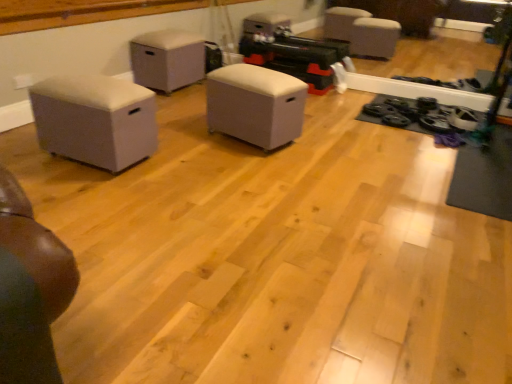
The image size is (512, 384). What do you see at coordinates (255, 105) in the screenshot? I see `white fabric ottoman at center, placed as the 2th furniture when sorted from front to back` at bounding box center [255, 105].

This screenshot has width=512, height=384. I want to click on matte gray ottoman at center, which is counted as the third furniture, starting from the front, so click(x=167, y=59).

At what (x,y) coordinates should I click in order to perform the action: click on beige fabric ottoman at left, acting as the third furniture starting from the back. Please return your answer as a coordinate pair (x, y). Looking at the image, I should click on (95, 120).

The height and width of the screenshot is (384, 512). What are the coordinates of `the 2nd furniture behind the beige fabric ottoman at left, which appears as the first furniture when viewed from the front` in the screenshot? It's located at (167, 59).

Between matte gray ottoman at center, the first furniture when ordered from back to front, and beige fabric ottoman at left, which appears as the first furniture when viewed from the front, which one is positioned in front?

Positioned in front is beige fabric ottoman at left, which appears as the first furniture when viewed from the front.

Does matte gray ottoman at center, which is counted as the third furniture, starting from the front, turn towards beige fabric ottoman at left, which appears as the first furniture when viewed from the front?

No, matte gray ottoman at center, which is counted as the third furniture, starting from the front, is not aimed at beige fabric ottoman at left, which appears as the first furniture when viewed from the front.

In the scene shown: Which is closer to the camera, (241, 88) or (150, 76)?

The point (241, 88) is closer.

Could you tell me if white fabric ottoman at center, which is the 2th furniture in back-to-front order, is facing matte gray ottoman at center, which is counted as the third furniture, starting from the front?

No, white fabric ottoman at center, which is the 2th furniture in back-to-front order, does not turn towards matte gray ottoman at center, which is counted as the third furniture, starting from the front.

Is white fabric ottoman at center, which is the 2th furniture in back-to-front order, positioned beyond the bounds of matte gray ottoman at center, which is counted as the third furniture, starting from the front?

Yes, white fabric ottoman at center, which is the 2th furniture in back-to-front order, is outside of matte gray ottoman at center, which is counted as the third furniture, starting from the front.

In the image, is white fabric ottoman at center, placed as the 2th furniture when sorted from front to back, positioned in front of or behind matte gray ottoman at center, which is counted as the third furniture, starting from the front?

white fabric ottoman at center, placed as the 2th furniture when sorted from front to back, is in front of matte gray ottoman at center, which is counted as the third furniture, starting from the front.

Is point (82, 121) closer to viewer compared to point (177, 39)?

That is True.

From a real-world perspective, between beige fabric ottoman at left, which appears as the first furniture when viewed from the front, and matte gray ottoman at center, which is counted as the third furniture, starting from the front, who is vertically lower?

From a 3D spatial view, beige fabric ottoman at left, which appears as the first furniture when viewed from the front, is below.

Based on the photo, can we say beige fabric ottoman at left, which appears as the first furniture when viewed from the front, lies outside matte gray ottoman at center, the first furniture when ordered from back to front?

Yes, beige fabric ottoman at left, which appears as the first furniture when viewed from the front, is outside of matte gray ottoman at center, the first furniture when ordered from back to front.

Would you consider beige fabric ottoman at left, which appears as the first furniture when viewed from the front, to be distant from white fabric ottoman at center, placed as the 2th furniture when sorted from front to back?

No, beige fabric ottoman at left, which appears as the first furniture when viewed from the front, is in close proximity to white fabric ottoman at center, placed as the 2th furniture when sorted from front to back.

Considering their positions, is beige fabric ottoman at left, acting as the third furniture starting from the back, located in front of or behind white fabric ottoman at center, which is the 2th furniture in back-to-front order?

beige fabric ottoman at left, acting as the third furniture starting from the back, is positioned closer to the viewer than white fabric ottoman at center, which is the 2th furniture in back-to-front order.

Considering the sizes of objects beige fabric ottoman at left, which appears as the first furniture when viewed from the front, and white fabric ottoman at center, placed as the 2th furniture when sorted from front to back, in the image provided, who is thinner, beige fabric ottoman at left, which appears as the first furniture when viewed from the front, or white fabric ottoman at center, placed as the 2th furniture when sorted from front to back,?

white fabric ottoman at center, placed as the 2th furniture when sorted from front to back, is thinner.

Relative to white fabric ottoman at center, which is the 2th furniture in back-to-front order, is matte gray ottoman at center, the first furniture when ordered from back to front, in front or behind?

Clearly, matte gray ottoman at center, the first furniture when ordered from back to front, is behind white fabric ottoman at center, which is the 2th furniture in back-to-front order.

Is matte gray ottoman at center, the first furniture when ordered from back to front, shorter than white fabric ottoman at center, placed as the 2th furniture when sorted from front to back?

In fact, matte gray ottoman at center, the first furniture when ordered from back to front, may be taller than white fabric ottoman at center, placed as the 2th furniture when sorted from front to back.

From a real-world perspective, which furniture is the 2nd one underneath the matte gray ottoman at center, which is counted as the third furniture, starting from the front? Please provide its 2D coordinates.

[(255, 105)]

Is white fabric ottoman at center, placed as the 2th furniture when sorted from front to back, in contact with beige fabric ottoman at left, acting as the third furniture starting from the back?

No, white fabric ottoman at center, placed as the 2th furniture when sorted from front to back, is not beside beige fabric ottoman at left, acting as the third furniture starting from the back.

Which is more to the right, white fabric ottoman at center, which is the 2th furniture in back-to-front order, or beige fabric ottoman at left, which appears as the first furniture when viewed from the front?

white fabric ottoman at center, which is the 2th furniture in back-to-front order.

Does white fabric ottoman at center, placed as the 2th furniture when sorted from front to back, have a lesser width compared to beige fabric ottoman at left, acting as the third furniture starting from the back?

Indeed, white fabric ottoman at center, placed as the 2th furniture when sorted from front to back, has a lesser width compared to beige fabric ottoman at left, acting as the third furniture starting from the back.

Which furniture is the 1st one when counting from the right side of the beige fabric ottoman at left, which appears as the first furniture when viewed from the front? Please provide its 2D coordinates.

[(167, 59)]

Find the location of a particular element. the 2nd furniture positioned below the matte gray ottoman at center, which is counted as the third furniture, starting from the front (from a real-world perspective) is located at coordinates (255, 105).

When comparing their distances from matte gray ottoman at center, the first furniture when ordered from back to front, does beige fabric ottoman at left, which appears as the first furniture when viewed from the front, or white fabric ottoman at center, placed as the 2th furniture when sorted from front to back, seem further?

beige fabric ottoman at left, which appears as the first furniture when viewed from the front.

Based on their spatial positions, is white fabric ottoman at center, which is the 2th furniture in back-to-front order, or beige fabric ottoman at left, which appears as the first furniture when viewed from the front, further from matte gray ottoman at center, which is counted as the third furniture, starting from the front?

Based on the image, beige fabric ottoman at left, which appears as the first furniture when viewed from the front, appears to be further to matte gray ottoman at center, which is counted as the third furniture, starting from the front.

Which object lies nearer to the anchor point white fabric ottoman at center, which is the 2th furniture in back-to-front order, matte gray ottoman at center, which is counted as the third furniture, starting from the front, or beige fabric ottoman at left, which appears as the first furniture when viewed from the front?

beige fabric ottoman at left, which appears as the first furniture when viewed from the front, is positioned closer to the anchor white fabric ottoman at center, which is the 2th furniture in back-to-front order.

Based on their spatial positions, is matte gray ottoman at center, which is counted as the third furniture, starting from the front, or white fabric ottoman at center, placed as the 2th furniture when sorted from front to back, closer to beige fabric ottoman at left, acting as the third furniture starting from the back?

The object closer to beige fabric ottoman at left, acting as the third furniture starting from the back, is white fabric ottoman at center, placed as the 2th furniture when sorted from front to back.

When comparing their distances from beige fabric ottoman at left, acting as the third furniture starting from the back, does white fabric ottoman at center, which is the 2th furniture in back-to-front order, or matte gray ottoman at center, the first furniture when ordered from back to front, seem further?

matte gray ottoman at center, the first furniture when ordered from back to front.

In the scene shown: Estimate the real-world distances between objects in this image. Which object is closer to white fabric ottoman at center, placed as the 2th furniture when sorted from front to back, beige fabric ottoman at left, which appears as the first furniture when viewed from the front, or matte gray ottoman at center, the first furniture when ordered from back to front?

beige fabric ottoman at left, which appears as the first furniture when viewed from the front, is closer to white fabric ottoman at center, placed as the 2th furniture when sorted from front to back.

Find the location of a particular element. Image resolution: width=512 pixels, height=384 pixels. furniture positioned between beige fabric ottoman at left, acting as the third furniture starting from the back, and matte gray ottoman at center, which is counted as the third furniture, starting from the front, from near to far is located at coordinates (255, 105).